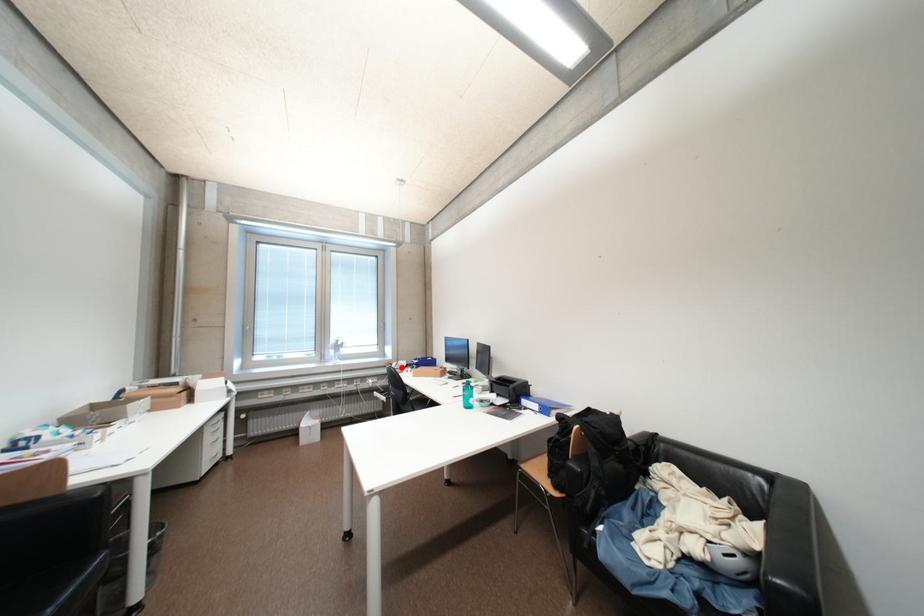
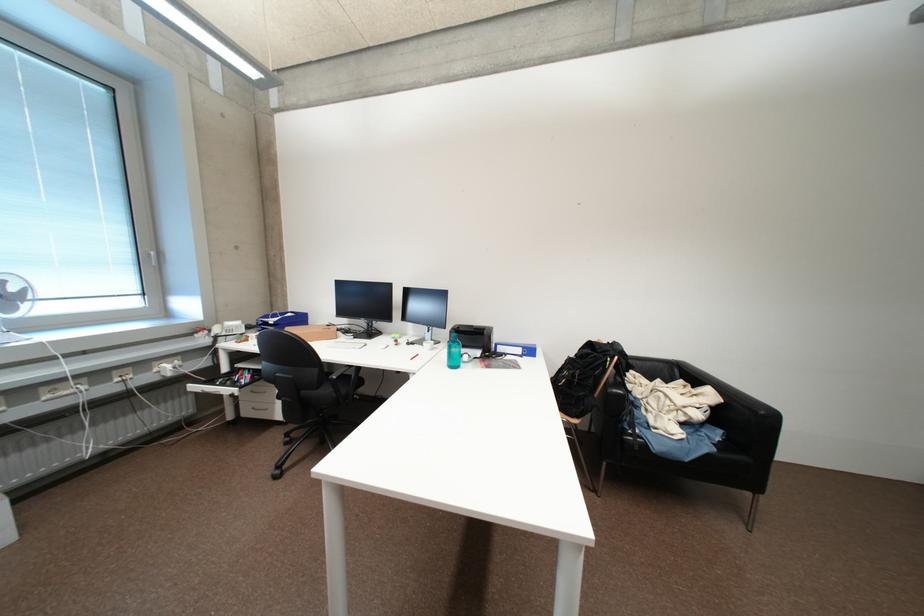
Locate, in the second image, the point that corresponds to the highlighted location in the first image.

(225, 331)